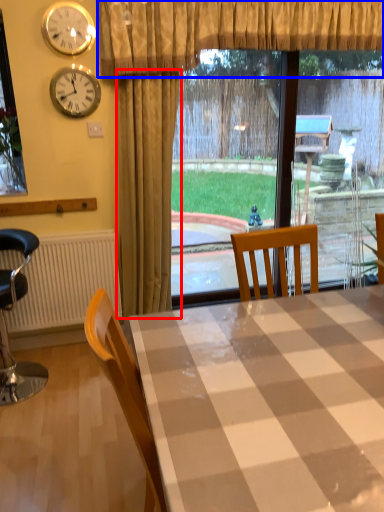
Question: Among these objects, which one is nearest to the camera, curtain (highlighted by a red box) or curtain (highlighted by a blue box)?

Choices:
 (A) curtain
 (B) curtain

Answer: (B)